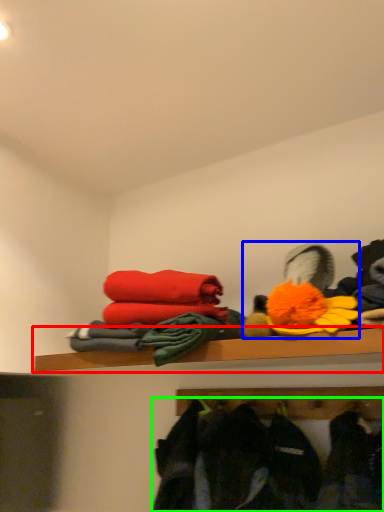
Question: Estimate the real-world distances between objects in this image. Which object is farther from shelf (highlighted by a red box), toy (highlighted by a blue box) or clothing (highlighted by a green box)?

Choices:
 (A) toy
 (B) clothing

Answer: (B)